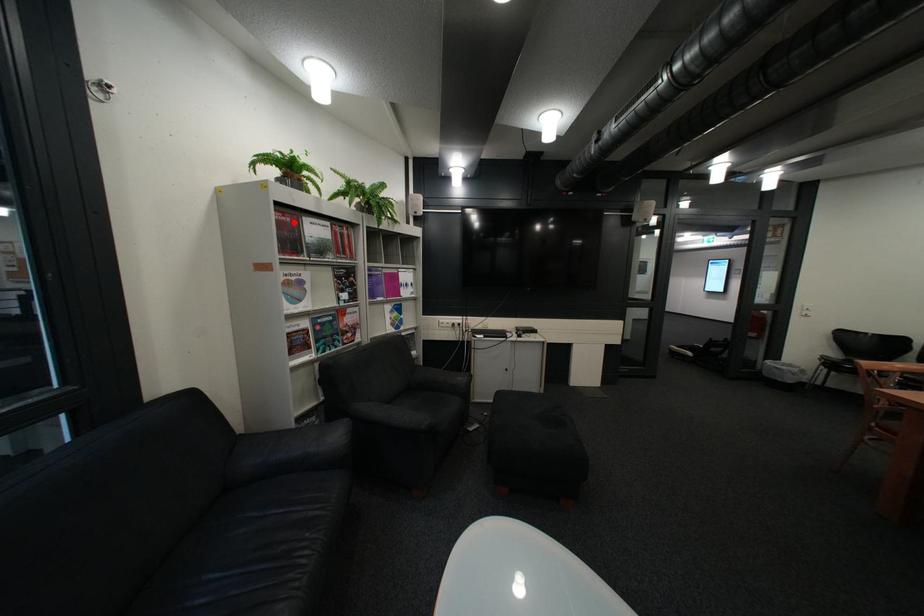
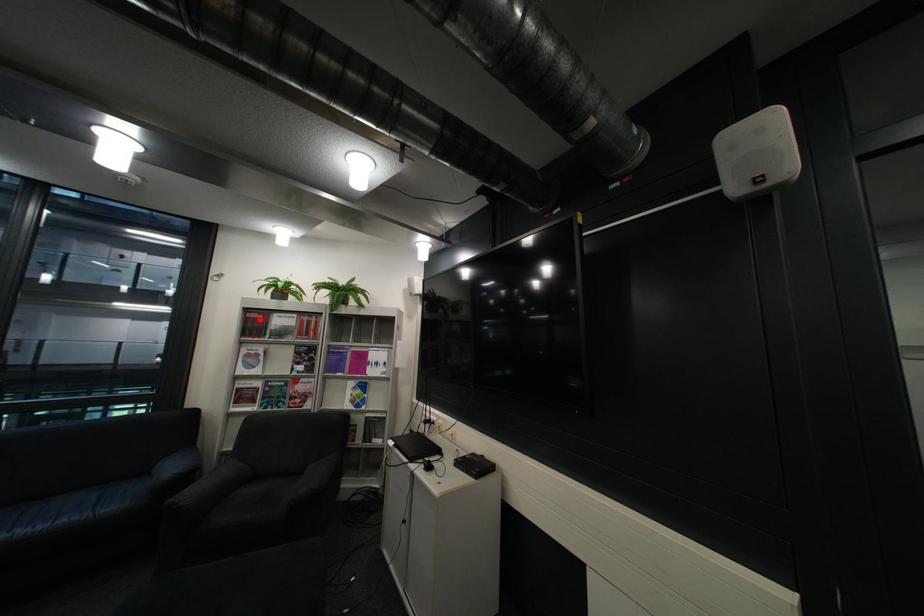
I am providing you with two images of the same scene from different viewpoints. A red point is marked on the first image and another point is marked on the second image. Are the points marked in image1 and image2 representing the same 3D position?

Yes